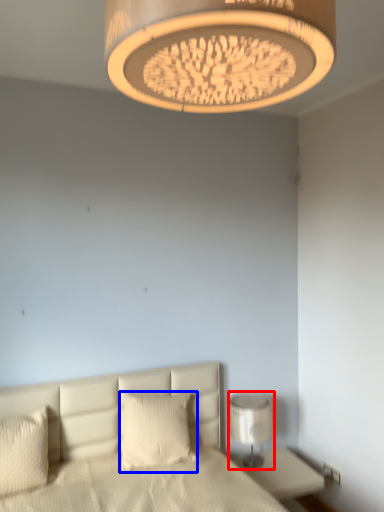
Question: Which of the following is the farthest to the observer, lamp (highlighted by a red box) or pillow (highlighted by a blue box)?

Choices:
 (A) lamp
 (B) pillow

Answer: (A)